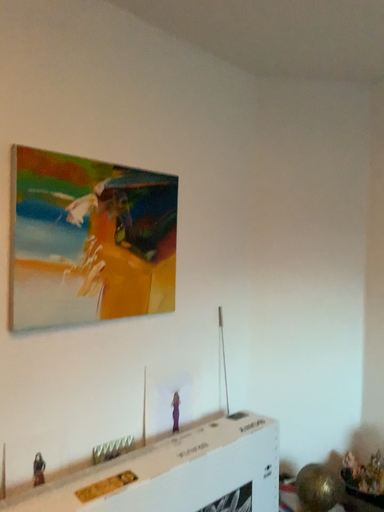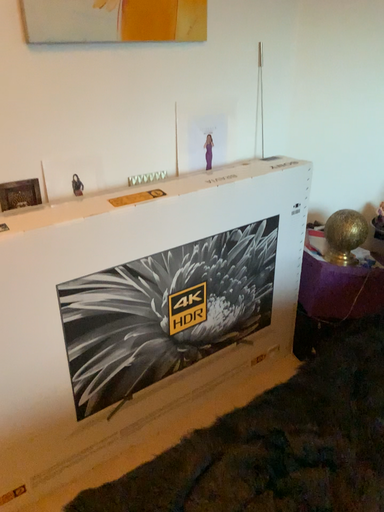
Question: How did the camera likely rotate when shooting the video?

Choices:
 (A) rotated downward
 (B) rotated upward

Answer: (A)